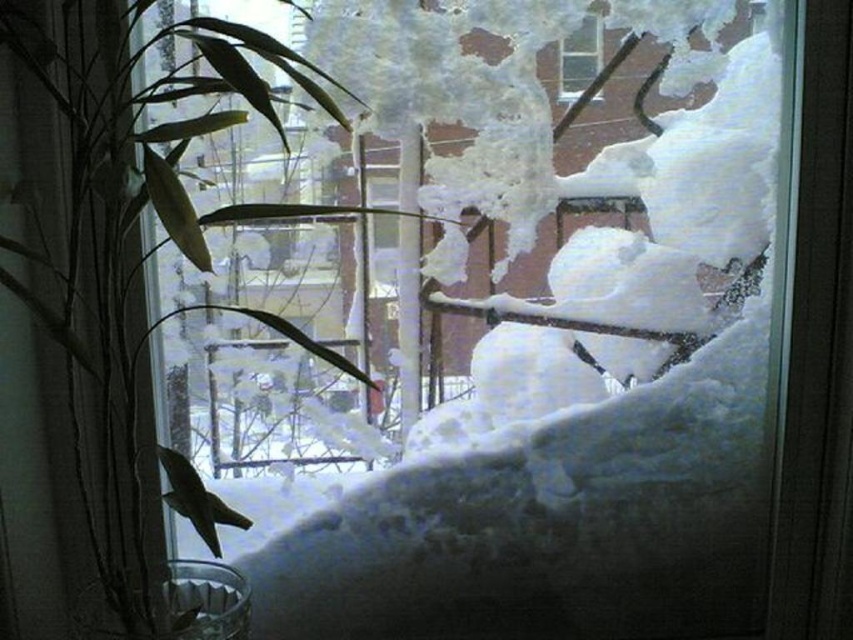
Question: Which object appears farthest from the camera in this image?

Choices:
 (A) green leafy plant at left
 (B) clear glass window at upper center

Answer: (B)

Question: Does green leafy plant at left lie behind clear glass window at upper center?

Choices:
 (A) yes
 (B) no

Answer: (B)

Question: Does green leafy plant at left have a smaller size compared to clear glass window at upper center?

Choices:
 (A) no
 (B) yes

Answer: (A)

Question: Which point is farther from the camera taking this photo?

Choices:
 (A) (45, 428)
 (B) (573, 38)

Answer: (B)

Question: Among these objects, which one is farthest from the camera?

Choices:
 (A) green leafy plant at left
 (B) clear glass window at upper center

Answer: (B)

Question: Is green leafy plant at left further to the viewer compared to clear glass window at upper center?

Choices:
 (A) yes
 (B) no

Answer: (B)